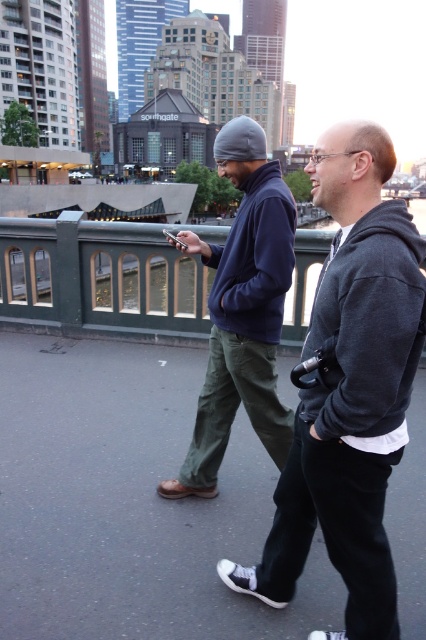
Can you confirm if dark gray hoodie at center is shorter than dark gray fleece at center?

No, dark gray hoodie at center is not shorter than dark gray fleece at center.

Does point (374, 448) lie in front of point (340, 298)?

That is False.

Find the location of a particular element. dark gray hoodie at center is located at coordinates (350, 390).

Does navy blue fleece at center appear on the right side of dark gray fleece at center?

No, navy blue fleece at center is not to the right of dark gray fleece at center.

Who is shorter, navy blue fleece at center or dark gray fleece at center?

dark gray fleece at center is shorter.

This screenshot has height=640, width=426. Describe the element at coordinates (241, 310) in the screenshot. I see `navy blue fleece at center` at that location.

Locate an element on the screen. Image resolution: width=426 pixels, height=640 pixels. navy blue fleece at center is located at coordinates (241, 310).

Between dark gray fleece at center and navy fleece sweatshirt at center, which one has more height?

dark gray fleece at center is taller.

Based on the photo, does dark gray fleece at center appear on the left side of navy fleece sweatshirt at center?

No, dark gray fleece at center is not to the left of navy fleece sweatshirt at center.

Is point (336, 308) in front of point (259, 237)?

Yes, it is in front of point (259, 237).

Where is `dark gray fleece at center`? This screenshot has height=640, width=426. dark gray fleece at center is located at coordinates (367, 326).